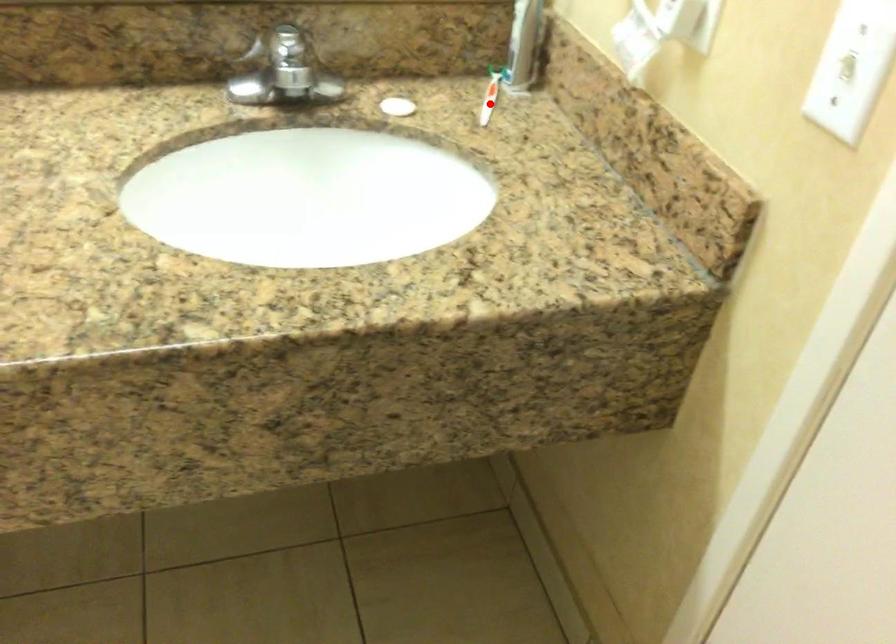
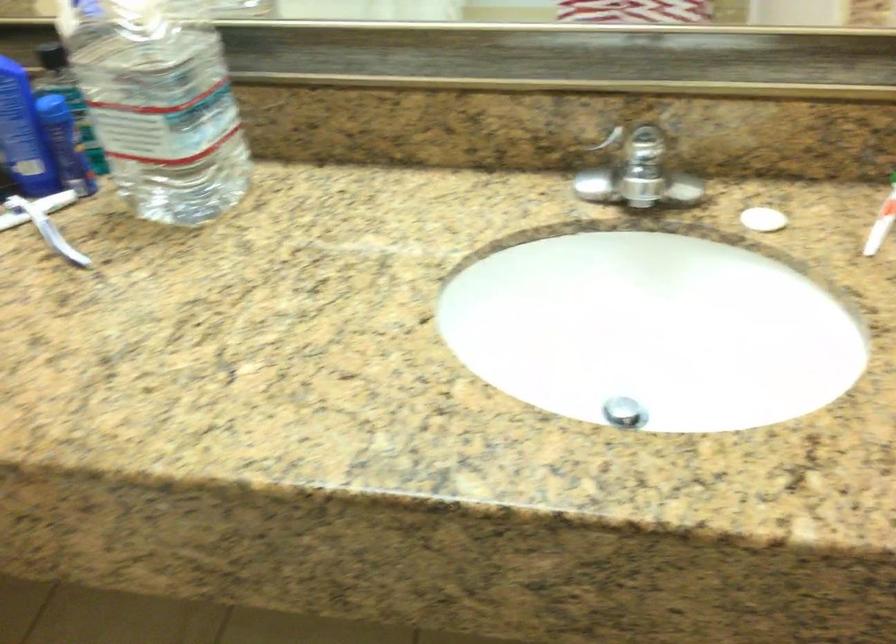
Question: I am providing you with two images of the same scene from different viewpoints. A red point is shown in image1. For the corresponding object point in image2, is it positioned nearer or farther from the camera?

Choices:
 (A) Nearer
 (B) Farther

Answer: (A)